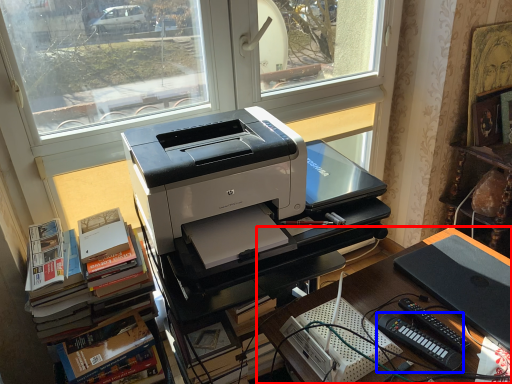
Question: Which of the following is the closest to the observer, desk (highlighted by a red box) or equipment (highlighted by a blue box)?

Choices:
 (A) desk
 (B) equipment

Answer: (A)